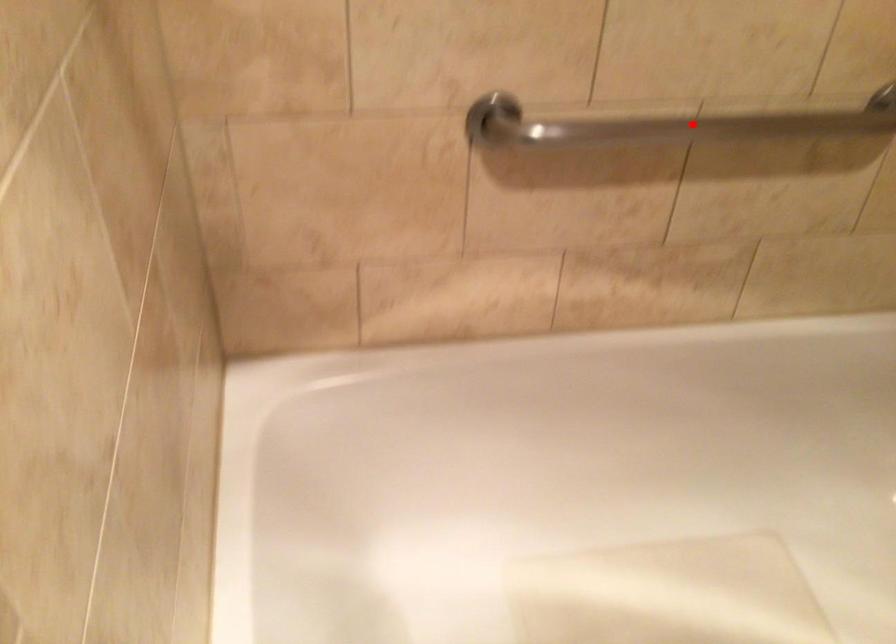
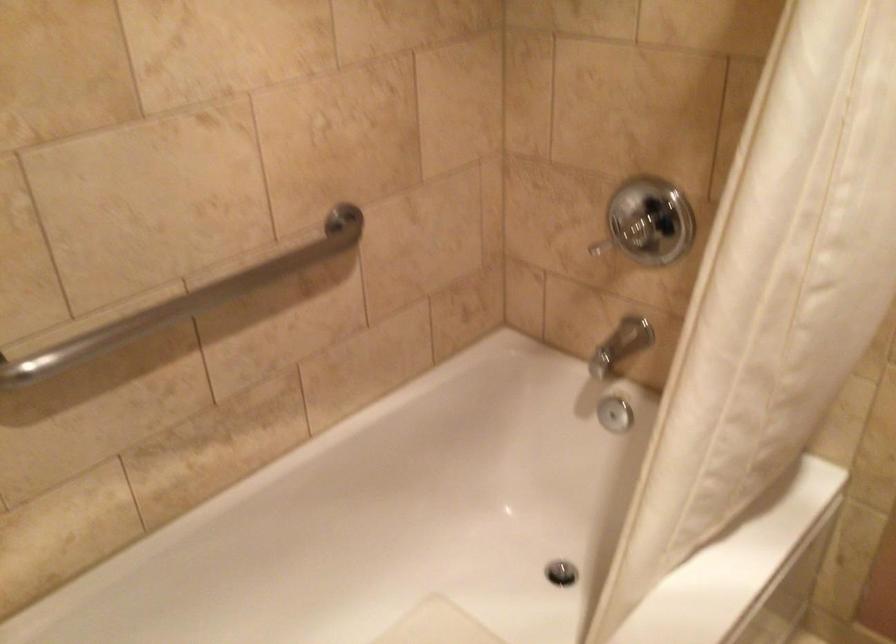
Where in the second image is the point corresponding to the highlighted location from the first image?

(185, 301)